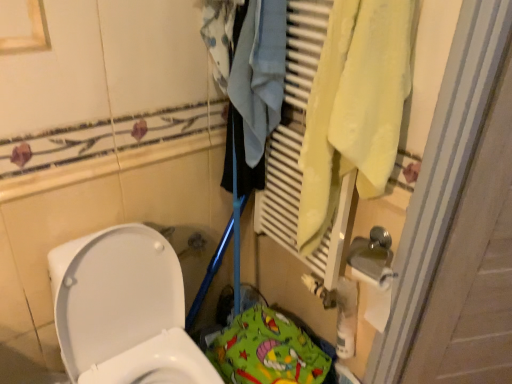
Question: Does white glossy toilet at lower left have a greater height compared to yellow fabric towel at right?

Choices:
 (A) no
 (B) yes

Answer: (B)

Question: Is white glossy toilet at lower left looking in the opposite direction of yellow fabric towel at right?

Choices:
 (A) no
 (B) yes

Answer: (A)

Question: Is white glossy toilet at lower left thinner than yellow fabric towel at right?

Choices:
 (A) no
 (B) yes

Answer: (A)

Question: Considering the relative sizes of white glossy toilet at lower left and yellow fabric towel at right in the image provided, is white glossy toilet at lower left shorter than yellow fabric towel at right?

Choices:
 (A) yes
 (B) no

Answer: (B)

Question: Is there a large distance between white glossy toilet at lower left and yellow fabric towel at right?

Choices:
 (A) yes
 (B) no

Answer: (B)

Question: Is the position of white glossy toilet at lower left less distant than that of yellow fabric towel at right?

Choices:
 (A) yes
 (B) no

Answer: (A)

Question: Is yellow fabric towel at right surrounding green fabric play mat at lower center?

Choices:
 (A) yes
 (B) no

Answer: (B)

Question: Is the surface of yellow fabric towel at right in direct contact with green fabric play mat at lower center?

Choices:
 (A) no
 (B) yes

Answer: (A)

Question: Does yellow fabric towel at right have a smaller size compared to green fabric play mat at lower center?

Choices:
 (A) yes
 (B) no

Answer: (B)

Question: From a real-world perspective, is yellow fabric towel at right positioned under green fabric play mat at lower center based on gravity?

Choices:
 (A) no
 (B) yes

Answer: (A)

Question: Is the position of yellow fabric towel at right more distant than that of green fabric play mat at lower center?

Choices:
 (A) no
 (B) yes

Answer: (A)

Question: Considering the relative sizes of yellow fabric towel at right and green fabric play mat at lower center in the image provided, is yellow fabric towel at right bigger than green fabric play mat at lower center?

Choices:
 (A) no
 (B) yes

Answer: (B)

Question: From a real-world perspective, is green fabric play mat at lower center below white glossy toilet at lower left?

Choices:
 (A) no
 (B) yes

Answer: (B)